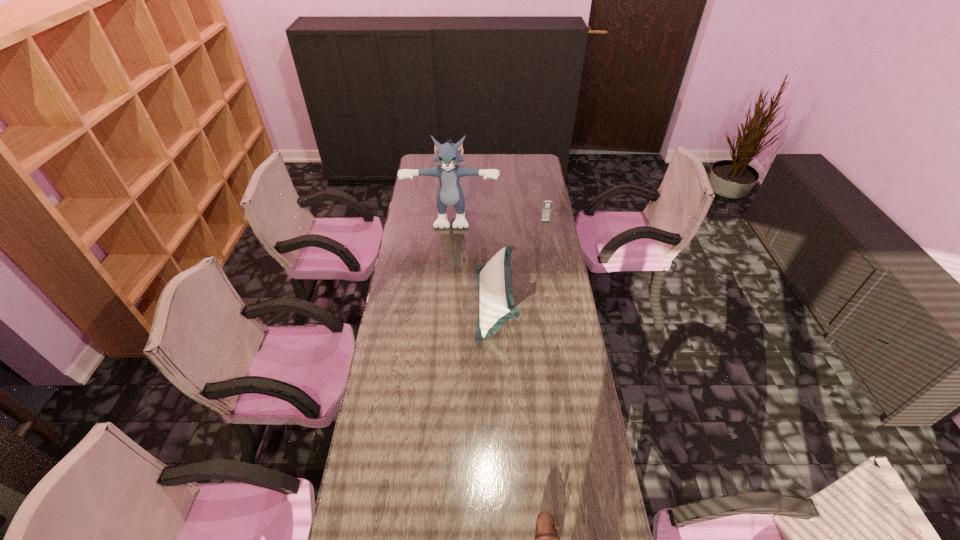
This screenshot has height=540, width=960. In order to click on the tallest object in this screenshot , I will do `click(449, 193)`.

Find the location of `the second nearest object`. the second nearest object is located at coordinates (494, 283).

At what (x,y) coordinates should I click in order to perform the action: click on the second tallest object. Please return your answer as a coordinate pair (x, y). This screenshot has height=540, width=960. Looking at the image, I should click on (494, 283).

You are a GUI agent. You are given a task and a screenshot of the screen. Output one action in this format:
    pyautogui.click(x=<x>, y=<y>)
    Task: Click on the cellular telephone
    
    Given the screenshot: What is the action you would take?
    pyautogui.click(x=547, y=204)

Image resolution: width=960 pixels, height=540 pixels. Find the location of `the rightmost object`. the rightmost object is located at coordinates coord(547,204).

You are a GUI agent. You are given a task and a screenshot of the screen. Output one action in this format:
    pyautogui.click(x=<x>, y=<y>)
    Task: Click on the blank area located 0.320m on the front-facing side of the cat
    
    Given the screenshot: What is the action you would take?
    pyautogui.click(x=447, y=276)

This screenshot has width=960, height=540. What are the coordinates of `vacant region located 0.160m on the surface of the second nearest object` in the screenshot? It's located at (437, 303).

What are the coordinates of `free spot located on the surface of the second nearest object` in the screenshot? It's located at (432, 303).

The height and width of the screenshot is (540, 960). I want to click on blank space located 0.050m on the surface of the second nearest object, so click(464, 303).

Locate an element on the screen. Image resolution: width=960 pixels, height=540 pixels. free spot located 0.370m on the front-facing side of the rightmost object is located at coordinates (554, 274).